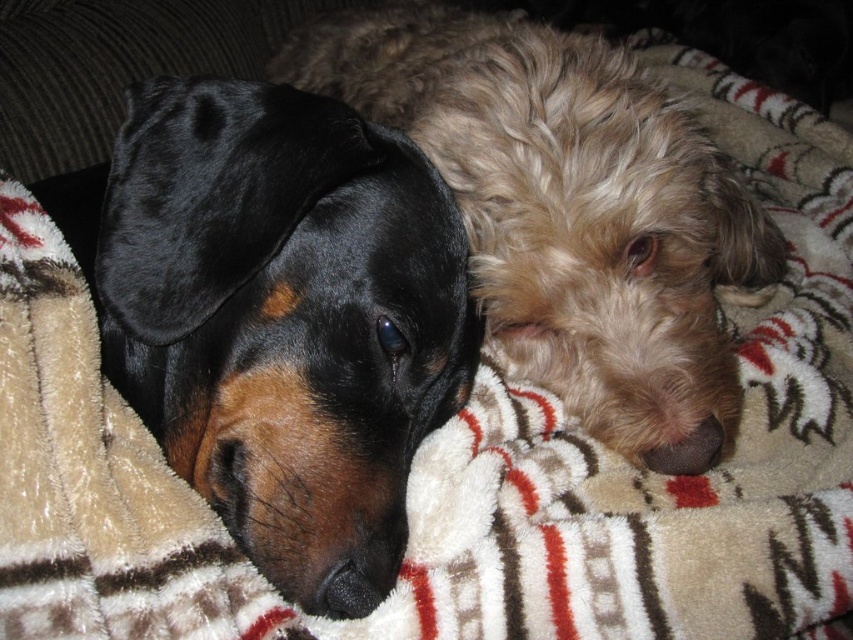
Question: Which of the following is the farthest from the observer?

Choices:
 (A) black velvet dog at left
 (B) shaggy beige dog at center

Answer: (B)

Question: From the image, what is the correct spatial relationship of black velvet dog at left in relation to shaggy beige dog at center?

Choices:
 (A) right
 (B) left

Answer: (B)

Question: Can you confirm if black velvet dog at left is positioned to the right of shaggy beige dog at center?

Choices:
 (A) no
 (B) yes

Answer: (A)

Question: Considering the relative positions of black velvet dog at left and shaggy beige dog at center in the image provided, where is black velvet dog at left located with respect to shaggy beige dog at center?

Choices:
 (A) left
 (B) right

Answer: (A)